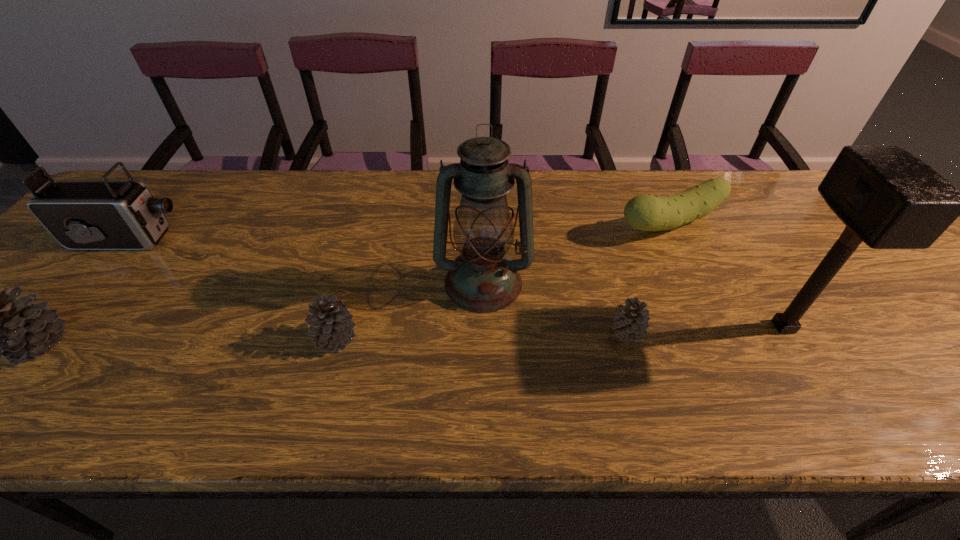
The image size is (960, 540). I want to click on the third object from left to right, so click(331, 323).

Locate an element on the screen. the second shortest pinecone is located at coordinates (x=331, y=323).

Identify the location of the shortest object. Image resolution: width=960 pixels, height=540 pixels. (631, 322).

Locate an element on the screen. This screenshot has width=960, height=540. the fifth object from left to right is located at coordinates (631, 322).

Find the location of a particular element. camcorder is located at coordinates (104, 214).

Identify the location of cucumber. (648, 212).

You are a GUI agent. You are given a task and a screenshot of the screen. Output one action in this format:
    pyautogui.click(x=<x>, y=<y>)
    Task: Click on the fourth object from right to left
    This screenshot has width=960, height=540.
    Given the screenshot: What is the action you would take?
    pyautogui.click(x=483, y=279)

At what (x,y) coordinates should I click in order to perform the action: click on mallet. Please return your answer as a coordinate pair (x, y). Image resolution: width=960 pixels, height=540 pixels. Looking at the image, I should click on (888, 198).

Identify the location of vacant point located 0.310m on the right of the fifth object from right to left. The width and height of the screenshot is (960, 540). (503, 338).

You are a GUI agent. You are given a task and a screenshot of the screen. Output one action in this format:
    pyautogui.click(x=<x>, y=<y>)
    Task: Click on the free space located on the back of the third object from right to left
    The image size is (960, 540).
    Given the screenshot: What is the action you would take?
    pyautogui.click(x=618, y=301)